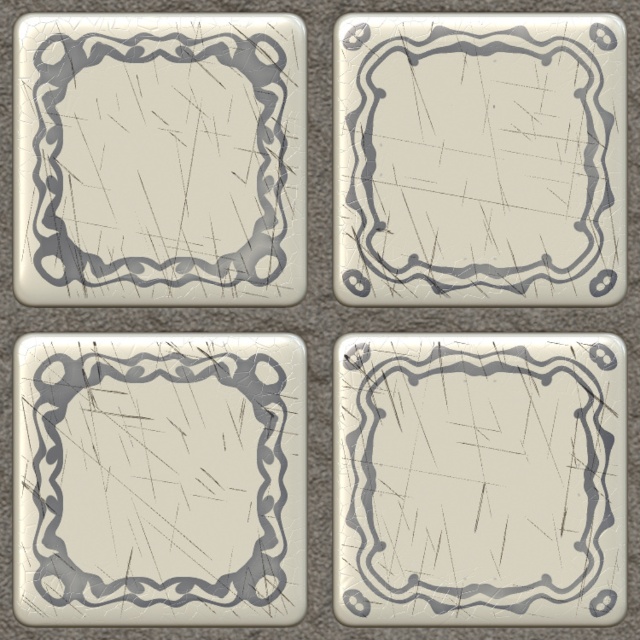
Who is lower down, matte plastic frame at upper right or matte white frame at center?

matte white frame at center is below.

Who is more forward, (612, 113) or (509, 353)?

Positioned in front is point (509, 353).

What do you see at coordinates (480, 160) in the screenshot? This screenshot has width=640, height=640. I see `matte plastic frame at upper right` at bounding box center [480, 160].

Where is `matte plastic frame at upper right`? Image resolution: width=640 pixels, height=640 pixels. matte plastic frame at upper right is located at coordinates (480, 160).

Between matte plastic frame at upper right and matte silver frame at bottom left, which one appears on the right side from the viewer's perspective?

From the viewer's perspective, matte plastic frame at upper right appears more on the right side.

Does matte plastic frame at upper right have a larger size compared to matte silver frame at bottom left?

No.

Is point (588, 84) positioned behind point (170, 392)?

That is True.

Find the location of a particular element. Image resolution: width=640 pixels, height=640 pixels. matte plastic frame at upper right is located at coordinates (480, 160).

Does matte plastic frame at upper right have a lesser height compared to matte silver frame at upper left?

In fact, matte plastic frame at upper right may be taller than matte silver frame at upper left.

Looking at this image, is matte plastic frame at upper right below matte silver frame at upper left?

Correct, matte plastic frame at upper right is located below matte silver frame at upper left.

Which is in front, point (588, 44) or point (204, 227)?

Point (588, 44) is in front.

I want to click on matte plastic frame at upper right, so click(480, 160).